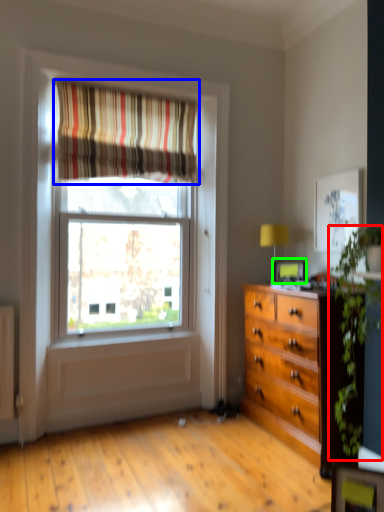
Question: Which object is the closest to the plant (highlighted by a red box)? Choose among these: curtain (highlighted by a blue box) or picture frame (highlighted by a green box).

Choices:
 (A) curtain
 (B) picture frame

Answer: (B)